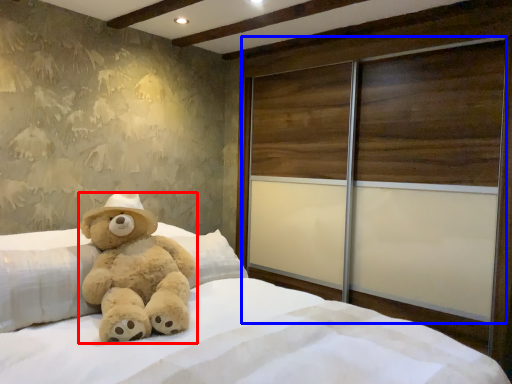
Question: Which object is closer to the camera taking this photo, teddy bear (highlighted by a red box) or screen door (highlighted by a blue box)?

Choices:
 (A) teddy bear
 (B) screen door

Answer: (A)